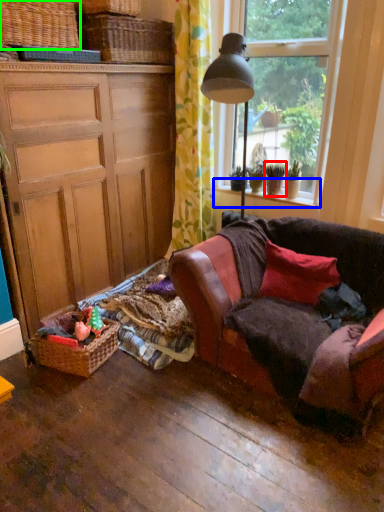
Question: Estimate the real-world distances between objects in this image. Which object is closer to houseplant (highlighted by a red box), window sill (highlighted by a blue box) or picnic basket (highlighted by a green box)?

Choices:
 (A) window sill
 (B) picnic basket

Answer: (A)